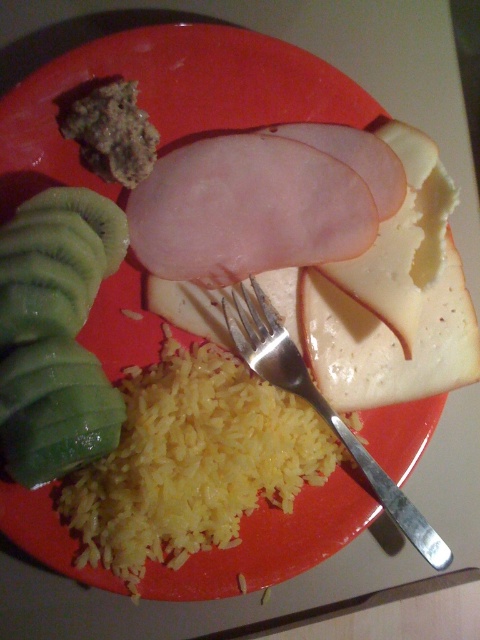
Can you confirm if yellow matte rice at center is positioned above green matte kiwi at lower left?

No, yellow matte rice at center is not above green matte kiwi at lower left.

Can you confirm if yellow matte rice at center is thinner than green matte kiwi at lower left?

No.

Image resolution: width=480 pixels, height=640 pixels. What do you see at coordinates (192, 461) in the screenshot?
I see `yellow matte rice at center` at bounding box center [192, 461].

What are the coordinates of `yellow matte rice at center` in the screenshot? It's located at (192, 461).

Between point (285, 346) and point (81, 211), which one is positioned in front?

Point (81, 211) is more forward.

Does point (403, 504) lie behind point (60, 196)?

Yes, point (403, 504) is behind point (60, 196).

Find the location of a particular element. The image size is (480, 640). silver metallic fork at center is located at coordinates (322, 410).

Where is `yellow matte rice at center`? yellow matte rice at center is located at coordinates (192, 461).

Is yellow matte rice at center further to camera compared to green juicy kiwi at left?

Yes.

Does point (301, 406) come farther from viewer compared to point (76, 212)?

Yes, it is.

Identify the location of yellow matte rice at center. (192, 461).